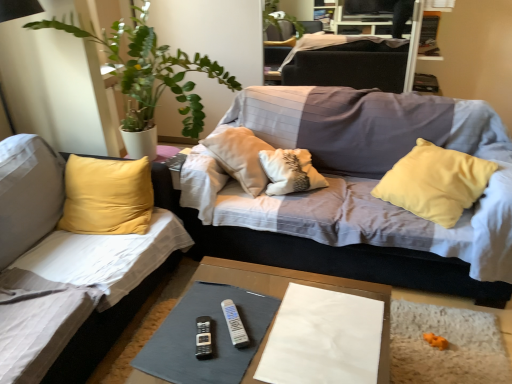
Identify the location of free space behind white plastic remote at center, which is the 1th remote from right to left. (237, 292).